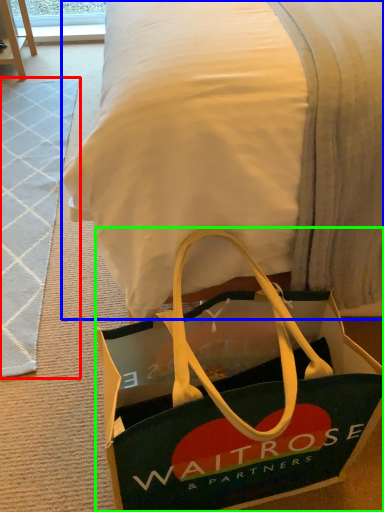
Question: Which object is the closest to the doormat (highlighted by a red box)? Choose among these: blanket (highlighted by a blue box) or handbag (highlighted by a green box).

Choices:
 (A) blanket
 (B) handbag

Answer: (B)